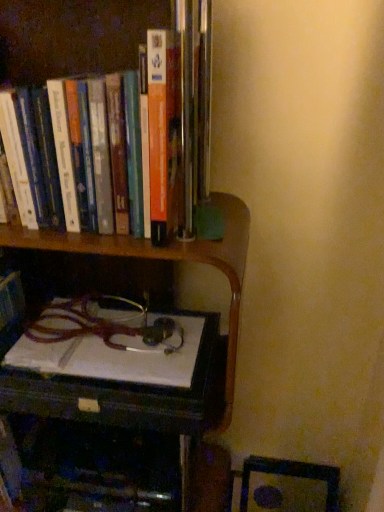
The height and width of the screenshot is (512, 384). Find the location of `hardcover books at upper left`. hardcover books at upper left is located at coordinates (73, 35).

Where is `wooden bookcase at upper left`? The image size is (384, 512). wooden bookcase at upper left is located at coordinates (167, 260).

The image size is (384, 512). What do you see at coordinates (166, 260) in the screenshot?
I see `wooden desk at lower center` at bounding box center [166, 260].

Where is `hardcover books at upper left`? The height and width of the screenshot is (512, 384). hardcover books at upper left is located at coordinates click(x=73, y=35).

Who is smaller, hardcover books at upper left or wooden bookcase at upper left?

hardcover books at upper left.

From the image's perspective, is hardcover books at upper left located beneath wooden bookcase at upper left?

No, from the image's perspective, hardcover books at upper left is not beneath wooden bookcase at upper left.

Is hardcover books at upper left not close to wooden bookcase at upper left?

No, there isn't a large distance between hardcover books at upper left and wooden bookcase at upper left.

Where is `bookcase below the hardcover books at upper left (from a real-world perspective)`? Image resolution: width=384 pixels, height=512 pixels. bookcase below the hardcover books at upper left (from a real-world perspective) is located at coordinates click(x=167, y=260).

Does wooden table at lower left come in front of wooden bookcase at upper left?

No, the depth of wooden table at lower left is greater than that of wooden bookcase at upper left.

From the image's perspective, would you say wooden table at lower left is positioned over wooden bookcase at upper left?

No.

Would you say wooden table at lower left is to the left or to the right of wooden bookcase at upper left in the picture?

Based on their positions, wooden table at lower left is located to the right of wooden bookcase at upper left.

The image size is (384, 512). I want to click on table located underneath the wooden bookcase at upper left (from a real-world perspective), so click(x=131, y=394).

Looking at this image, from a real-world perspective, is wooden bookcase at upper left on wooden desk at lower center?

No, from a real-world perspective, wooden bookcase at upper left is not over wooden desk at lower center

Is wooden bookcase at upper left surrounding wooden desk at lower center?

That's correct, wooden desk at lower center is inside wooden bookcase at upper left.

Is wooden bookcase at upper left bigger than wooden desk at lower center?

Correct, wooden bookcase at upper left is larger in size than wooden desk at lower center.

Considering the positions of objects wooden bookcase at upper left and wooden table at lower left in the image provided, who is more to the left, wooden bookcase at upper left or wooden table at lower left?

Positioned to the left is wooden bookcase at upper left.

Can you tell me how much wooden bookcase at upper left and wooden table at lower left differ in facing direction?

The angle between the facing direction of wooden bookcase at upper left and the facing direction of wooden table at lower left is 2.88 degrees.

Considering the relative sizes of wooden bookcase at upper left and wooden table at lower left in the image provided, is wooden bookcase at upper left smaller than wooden table at lower left?

Incorrect, wooden bookcase at upper left is not smaller in size than wooden table at lower left.

Is wooden bookcase at upper left at the back of wooden desk at lower center?

Yes, wooden desk at lower center's orientation is away from wooden bookcase at upper left.

Consider the image. Is wooden desk at lower center positioned behind wooden bookcase at upper left?

Yes.

From a real-world perspective, is wooden desk at lower center physically located above or below wooden bookcase at upper left?

In terms of real-world spatial position, wooden desk at lower center is above wooden bookcase at upper left.

Can you confirm if wooden desk at lower center is positioned to the right of wooden bookcase at upper left?

Yes.

Is there a large distance between hardcover books at upper left and wooden desk at lower center?

No, hardcover books at upper left is not far from wooden desk at lower center.

Who is more distant, hardcover books at upper left or wooden desk at lower center?

Positioned behind is wooden desk at lower center.

Consider the image. In terms of width, does hardcover books at upper left look wider or thinner when compared to wooden desk at lower center?

Considering their sizes, hardcover books at upper left looks slimmer than wooden desk at lower center.

Is hardcover books at upper left positioned beyond the bounds of wooden desk at lower center?

Yes.

Can you see wooden table at lower left touching hardcover books at upper left?

No, wooden table at lower left is not beside hardcover books at upper left.

From the picture: Between wooden table at lower left and hardcover books at upper left, which one has more height?

hardcover books at upper left is taller.

In the image, there is a wooden table at lower left. Where is `book above it (from the image's perspective)`? book above it (from the image's perspective) is located at coordinates (73, 35).

Image resolution: width=384 pixels, height=512 pixels. In order to click on bookcase that appears below the hardcover books at upper left (from the image's perspective) in this screenshot , I will do `click(167, 260)`.

This screenshot has width=384, height=512. Identify the location of table lying behind the wooden bookcase at upper left. (131, 394).

Looking at the image, which one is located further to wooden bookcase at upper left, wooden desk at lower center or wooden table at lower left?

Based on the image, wooden table at lower left appears to be further to wooden bookcase at upper left.

When comparing their distances from wooden table at lower left, does wooden desk at lower center or wooden bookcase at upper left seem closer?

Based on the image, wooden bookcase at upper left appears to be nearer to wooden table at lower left.

Considering their positions, is wooden table at lower left positioned closer to wooden desk at lower center than wooden bookcase at upper left?

The object closer to wooden desk at lower center is wooden bookcase at upper left.

From the image, which object appears to be nearer to hardcover books at upper left, wooden desk at lower center or wooden table at lower left?

Among the two, wooden desk at lower center is located nearer to hardcover books at upper left.

Considering their positions, is hardcover books at upper left positioned closer to wooden bookcase at upper left than wooden desk at lower center?

Among the two, wooden desk at lower center is located nearer to wooden bookcase at upper left.

Which object lies nearer to the anchor point wooden table at lower left, wooden bookcase at upper left or hardcover books at upper left?

wooden bookcase at upper left.

Looking at this image, from the image, which object appears to be nearer to wooden table at lower left, hardcover books at upper left or wooden desk at lower center?

Among the two, wooden desk at lower center is located nearer to wooden table at lower left.

When comparing their distances from hardcover books at upper left, does wooden desk at lower center or wooden bookcase at upper left seem further?

wooden bookcase at upper left is positioned further to the anchor hardcover books at upper left.

Find the location of `bookcase between hardcover books at upper left and wooden table at lower left in the up-down direction`. bookcase between hardcover books at upper left and wooden table at lower left in the up-down direction is located at coordinates (167, 260).

Locate an element on the screen. The height and width of the screenshot is (512, 384). shelf between hardcover books at upper left and wooden table at lower left vertically is located at coordinates (166, 260).

I want to click on shelf between hardcover books at upper left and wooden bookcase at upper left from top to bottom, so click(x=166, y=260).

Identify the location of shelf located between wooden bookcase at upper left and wooden table at lower left in the depth direction. (166, 260).